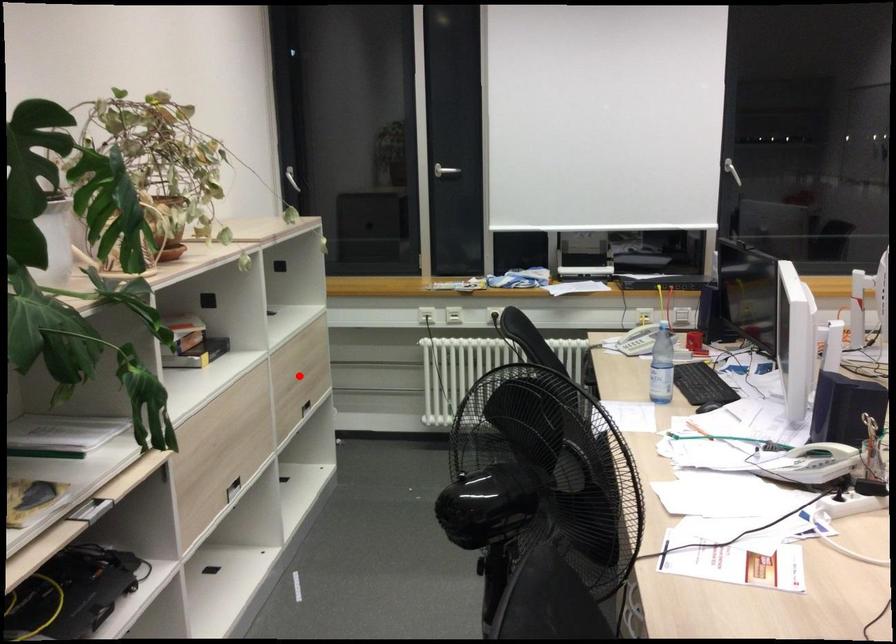
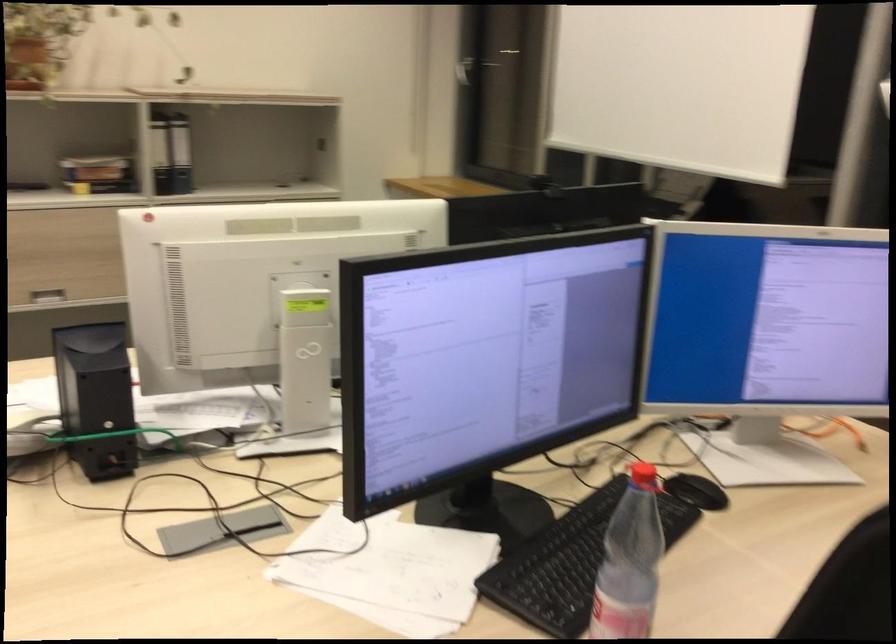
Question: I am providing you with two images of the same scene from different viewpoints. A red point is marked on the first image. At the location where the point appears in image 1, is it still visible in image 2?

Choices:
 (A) Yes
 (B) No

Answer: (B)